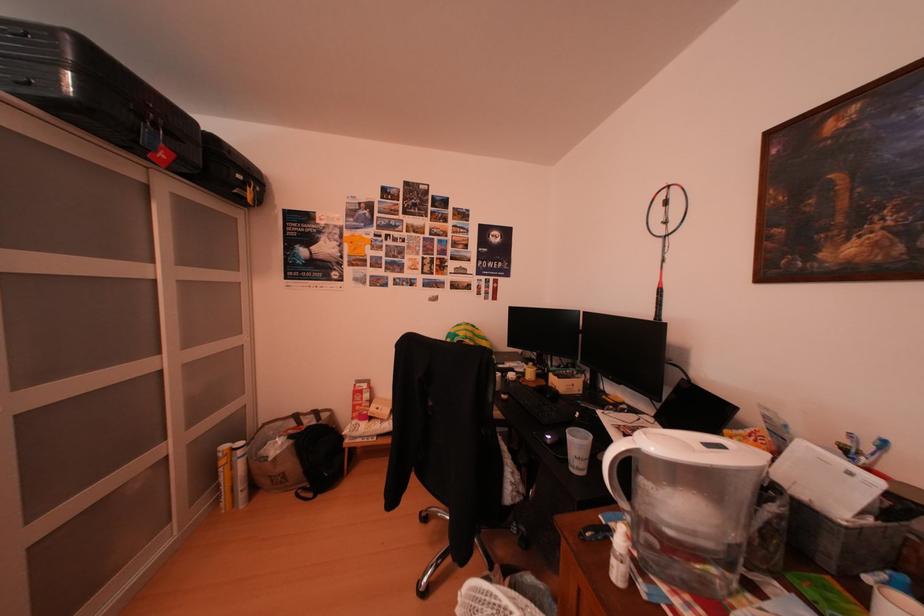
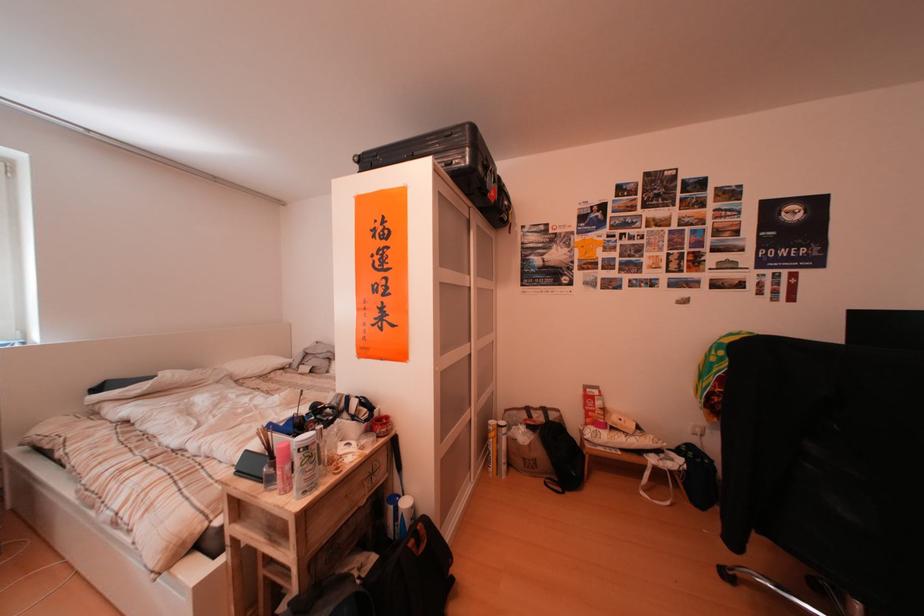
The point at (310,421) is marked in the first image. Where is the corresponding point in the second image?

(541, 415)